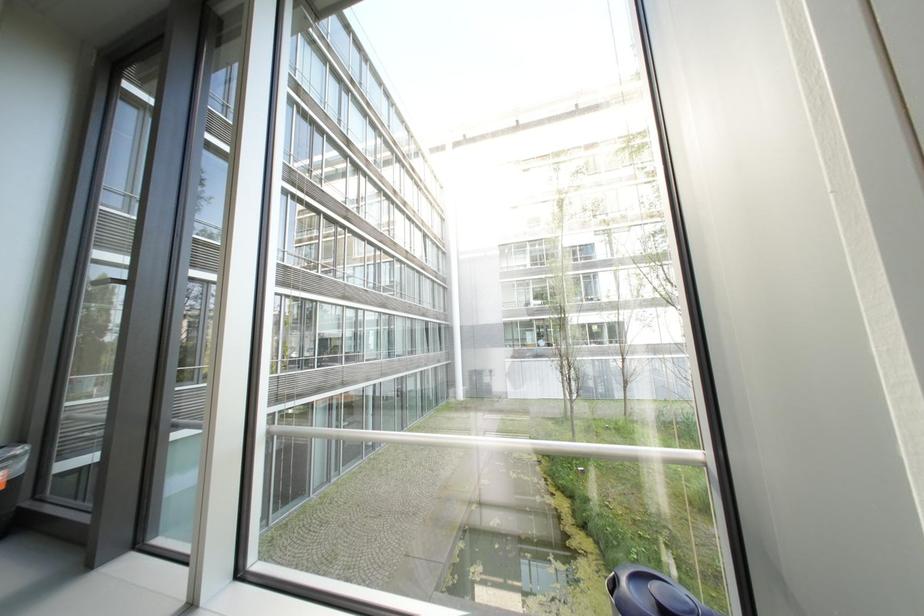
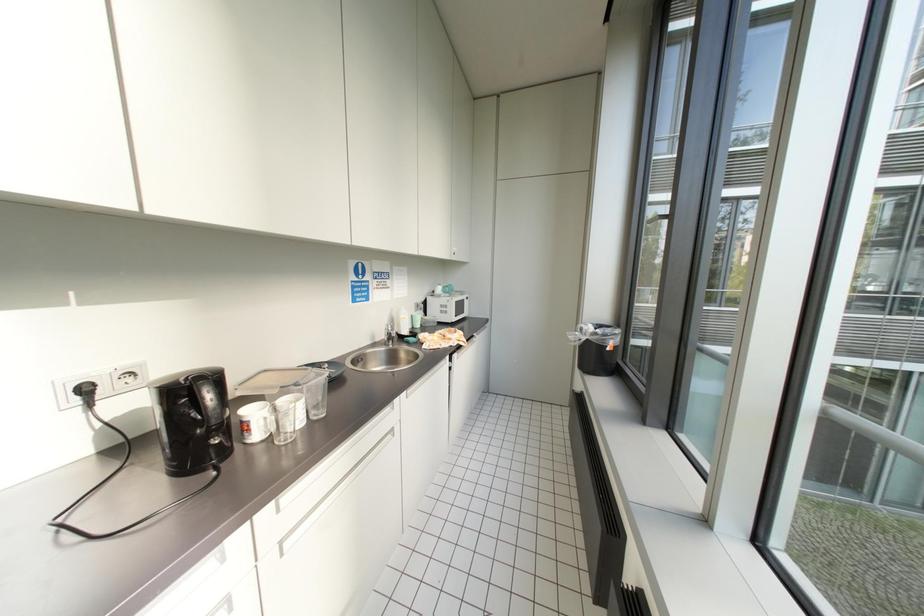
Question: The camera is either moving clockwise (left) or counter-clockwise (right) around the object. The first image is from the beginning of the video and the second image is from the end. Is the camera moving left or right when shooting the video?

Choices:
 (A) Left
 (B) Right

Answer: (B)